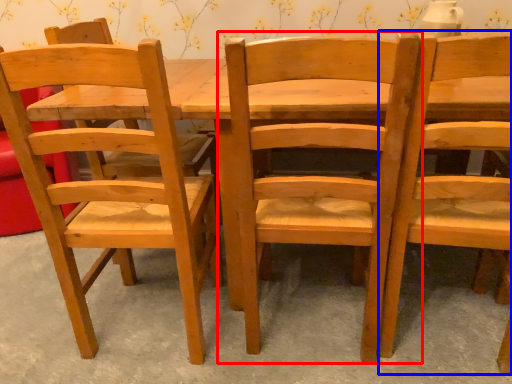
Question: Among these objects, which one is nearest to the camera, chair (highlighted by a red box) or chair (highlighted by a blue box)?

Choices:
 (A) chair
 (B) chair

Answer: (B)